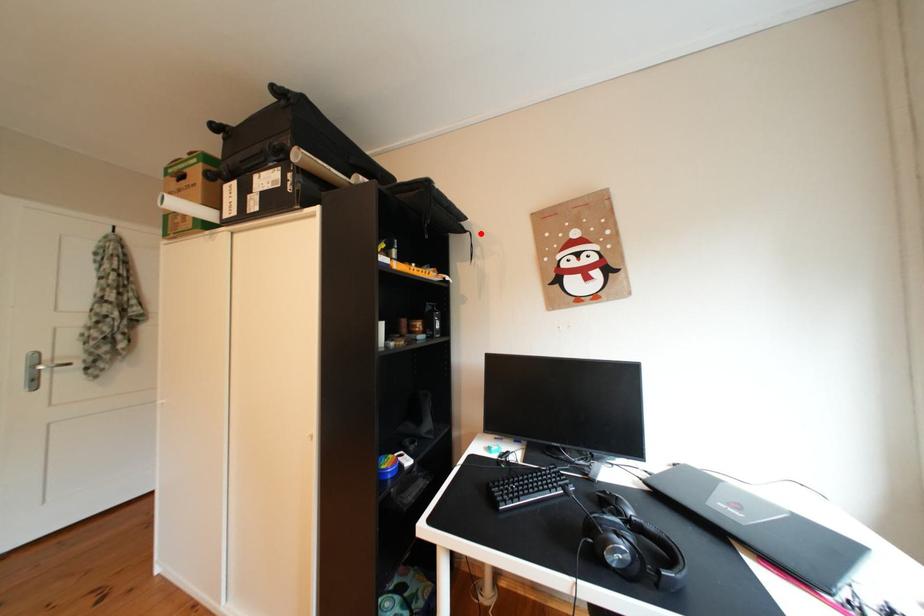
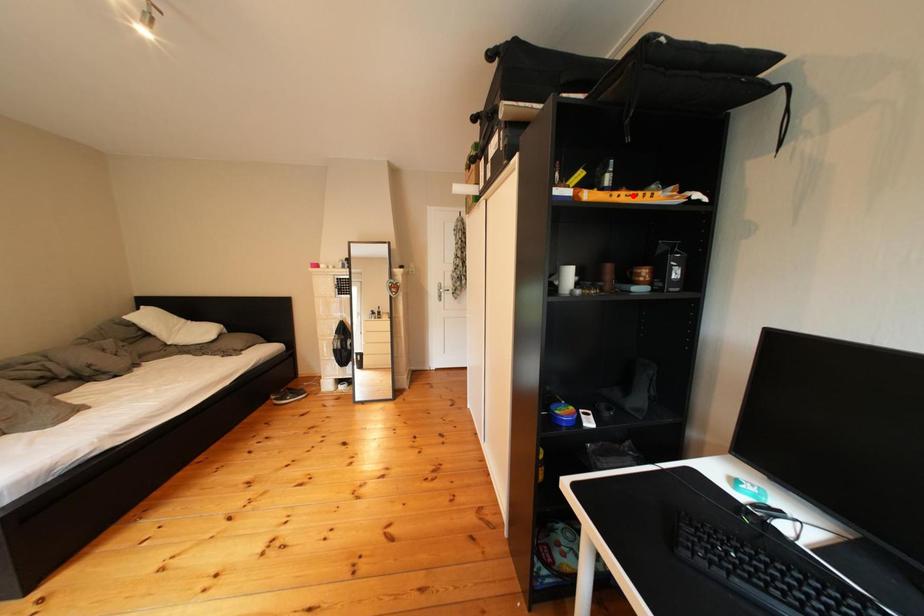
I am providing you with two images of the same scene from different viewpoints. A red point is marked on the first image and another point is marked on the second image. Do the highlighted points in image1 and image2 indicate the same real-world spot?

No